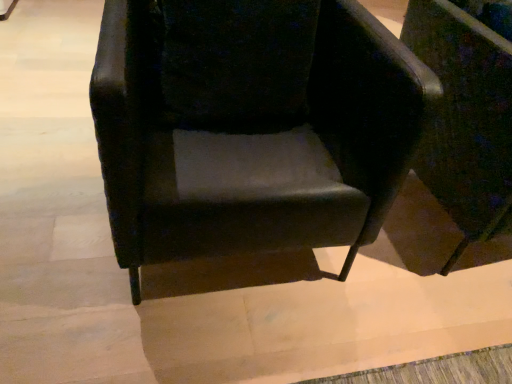
Question: Should I look upward or downward to see matte black chair at center, the 2th chair from the left?

Choices:
 (A) up
 (B) down

Answer: (A)

Question: Does velvet black armchair at center, which is counted as the second chair, starting from the right, appear on the right side of matte black chair at center, the 1th chair viewed from the right?

Choices:
 (A) no
 (B) yes

Answer: (A)

Question: Does velvet black armchair at center, which is counted as the second chair, starting from the right, have a smaller size compared to matte black chair at center, the 1th chair viewed from the right?

Choices:
 (A) no
 (B) yes

Answer: (A)

Question: From a real-world perspective, is velvet black armchair at center, marked as the 1th chair in a left-to-right arrangement, on top of matte black chair at center, the 1th chair viewed from the right?

Choices:
 (A) no
 (B) yes

Answer: (B)

Question: Are velvet black armchair at center, which is counted as the second chair, starting from the right, and matte black chair at center, the 1th chair viewed from the right, located far from each other?

Choices:
 (A) yes
 (B) no

Answer: (B)

Question: Does velvet black armchair at center, marked as the 1th chair in a left-to-right arrangement, appear on the left side of matte black chair at center, the 2th chair from the left?

Choices:
 (A) yes
 (B) no

Answer: (A)

Question: Would you say matte black chair at center, the 2th chair from the left, is part of velvet black armchair at center, which is counted as the second chair, starting from the right,'s contents?

Choices:
 (A) no
 (B) yes

Answer: (A)

Question: Is matte black chair at center, the 2th chair from the left, not inside velvet black armchair at center, marked as the 1th chair in a left-to-right arrangement?

Choices:
 (A) yes
 (B) no

Answer: (A)

Question: From a real-world perspective, is matte black chair at center, the 2th chair from the left, physically below velvet black armchair at center, marked as the 1th chair in a left-to-right arrangement?

Choices:
 (A) no
 (B) yes

Answer: (B)

Question: Is matte black chair at center, the 2th chair from the left, placed right next to velvet black armchair at center, marked as the 1th chair in a left-to-right arrangement?

Choices:
 (A) no
 (B) yes

Answer: (A)

Question: Does matte black chair at center, the 1th chair viewed from the right, have a greater width compared to velvet black armchair at center, marked as the 1th chair in a left-to-right arrangement?

Choices:
 (A) yes
 (B) no

Answer: (B)

Question: Is matte black chair at center, the 2th chair from the left, oriented away from velvet black armchair at center, marked as the 1th chair in a left-to-right arrangement?

Choices:
 (A) no
 (B) yes

Answer: (A)

Question: From the image's perspective, is matte black chair at center, the 1th chair viewed from the right, located beneath velvet black armchair at center, which is counted as the second chair, starting from the right?

Choices:
 (A) no
 (B) yes

Answer: (A)

Question: Considering their positions, is velvet black armchair at center, which is counted as the second chair, starting from the right, located in front of or behind matte black chair at center, the 1th chair viewed from the right?

Choices:
 (A) behind
 (B) front

Answer: (B)